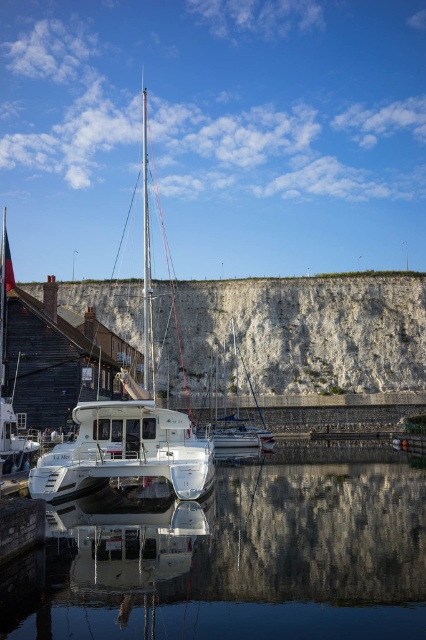
Question: Among these objects, which one is farthest from the camera?

Choices:
 (A) white stone cliff at center
 (B) white glossy catamaran at center
 (C) transparent glass water at center
 (D) white glossy sailboat at center

Answer: (A)

Question: Considering the real-world distances, which object is farthest from the white glossy mast at center?

Choices:
 (A) white glossy sailboat at center
 (B) white stone cliff at center
 (C) white glossy catamaran at center

Answer: (B)

Question: Based on their relative distances, which object is nearer to the white stone cliff at center?

Choices:
 (A) white glossy sailboat at center
 (B) white glossy catamaran at center
 (C) white glossy mast at center

Answer: (C)

Question: Can you confirm if white glossy catamaran at center is bigger than white glossy mast at center?

Choices:
 (A) no
 (B) yes

Answer: (A)

Question: Can you confirm if white glossy catamaran at center is positioned to the right of white glossy mast at center?

Choices:
 (A) yes
 (B) no

Answer: (A)

Question: Is transparent glass water at center wider than white stone cliff at center?

Choices:
 (A) no
 (B) yes

Answer: (A)